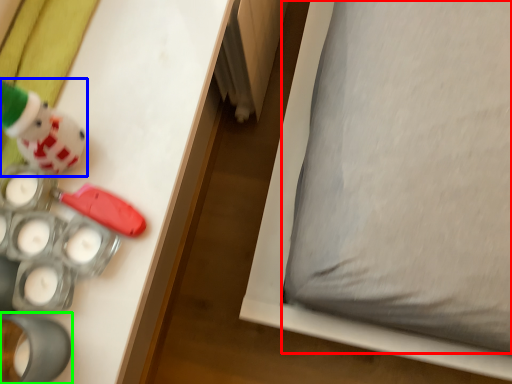
Question: Which object is the closest to the pillow (highlighted by a red box)? Choose among these: toy (highlighted by a blue box) or toy (highlighted by a green box).

Choices:
 (A) toy
 (B) toy

Answer: (A)